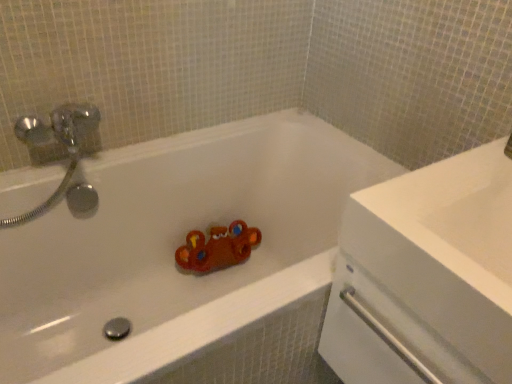
Question: From the image's perspective, is white glossy bathtub at center under white glossy sink at upper right?

Choices:
 (A) no
 (B) yes

Answer: (B)

Question: Is white glossy bathtub at center at the right side of white glossy sink at upper right?

Choices:
 (A) no
 (B) yes

Answer: (A)

Question: Is white glossy bathtub at center surrounding white glossy sink at upper right?

Choices:
 (A) yes
 (B) no

Answer: (B)

Question: Is the position of white glossy bathtub at center less distant than that of white glossy sink at upper right?

Choices:
 (A) yes
 (B) no

Answer: (B)

Question: From a real-world perspective, is white glossy bathtub at center physically below white glossy sink at upper right?

Choices:
 (A) yes
 (B) no

Answer: (A)

Question: Can you confirm if white glossy bathtub at center is taller than white glossy sink at upper right?

Choices:
 (A) yes
 (B) no

Answer: (A)

Question: From the image's perspective, is white glossy sink at upper right on white glossy bathtub at center?

Choices:
 (A) yes
 (B) no

Answer: (A)

Question: From a real-world perspective, is white glossy sink at upper right under white glossy bathtub at center?

Choices:
 (A) no
 (B) yes

Answer: (A)

Question: Is white glossy sink at upper right placed right next to white glossy bathtub at center?

Choices:
 (A) yes
 (B) no

Answer: (B)

Question: Is white glossy sink at upper right taller than white glossy bathtub at center?

Choices:
 (A) yes
 (B) no

Answer: (B)

Question: Is white glossy sink at upper right bigger than white glossy bathtub at center?

Choices:
 (A) no
 (B) yes

Answer: (A)

Question: Is white glossy sink at upper right smaller than white glossy bathtub at center?

Choices:
 (A) no
 (B) yes

Answer: (B)

Question: Relative to white glossy sink at upper right, is white glossy bathtub at center in front or behind?

Choices:
 (A) front
 (B) behind

Answer: (B)